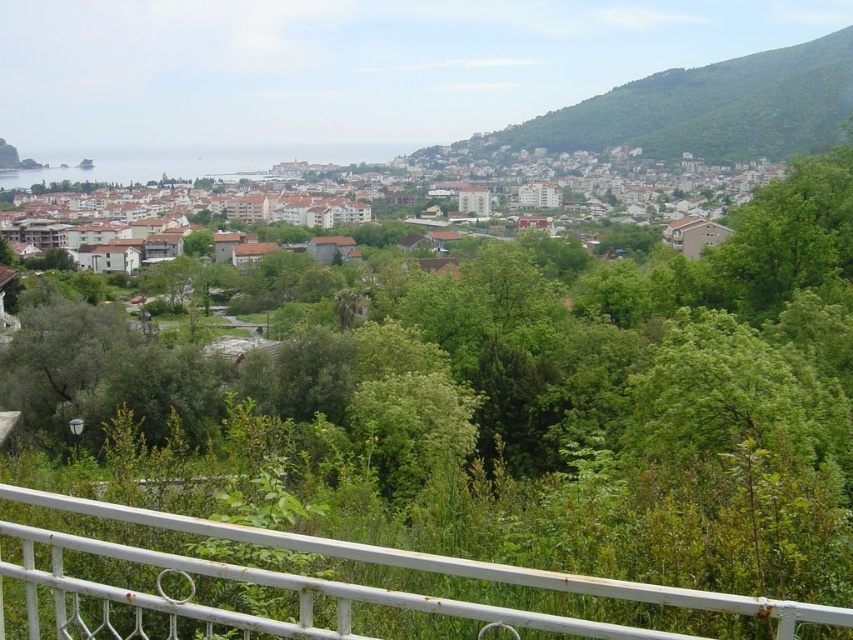
Is white metal railing at lower center below white matte buildings at center?

Indeed, white metal railing at lower center is positioned under white matte buildings at center.

This screenshot has height=640, width=853. What do you see at coordinates (263, 584) in the screenshot? I see `white metal railing at lower center` at bounding box center [263, 584].

The width and height of the screenshot is (853, 640). What are the coordinates of `white metal railing at lower center` in the screenshot? It's located at click(263, 584).